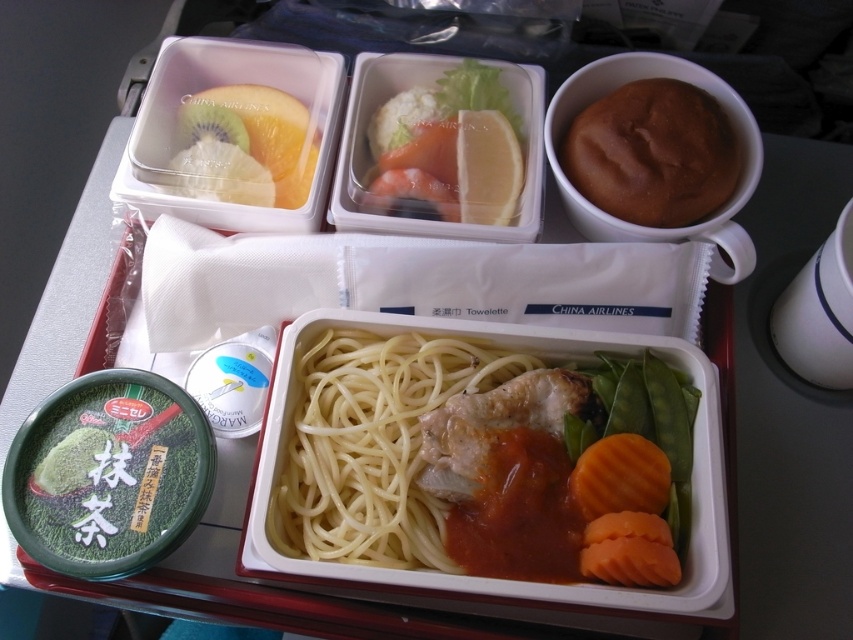
Is yellow matte noodles at center in front of brown matte bread roll at upper right?

Yes, yellow matte noodles at center is closer to the viewer.

Who is positioned more to the right, yellow matte noodles at center or brown matte bread roll at upper right?

brown matte bread roll at upper right is more to the right.

Is point (329, 552) closer to camera compared to point (647, 177)?

Yes, it is.

Image resolution: width=853 pixels, height=640 pixels. I want to click on yellow matte noodles at center, so click(x=373, y=444).